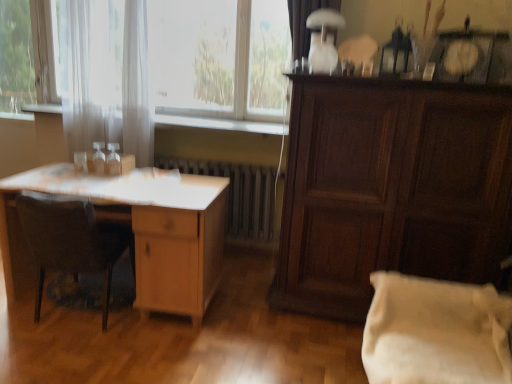
Question: Is white sheer curtain at left, which is the 1th curtain from back to front, wider than metallic silver radiator at center?

Choices:
 (A) yes
 (B) no

Answer: (A)

Question: From the image's perspective, is white sheer curtain at left, placed as the 1th curtain when sorted from left to right, on top of metallic silver radiator at center?

Choices:
 (A) yes
 (B) no

Answer: (A)

Question: Does white sheer curtain at left, placed as the 1th curtain when sorted from left to right, contain metallic silver radiator at center?

Choices:
 (A) no
 (B) yes

Answer: (A)

Question: Can you confirm if white sheer curtain at left, placed as the 1th curtain when sorted from left to right, is taller than metallic silver radiator at center?

Choices:
 (A) no
 (B) yes

Answer: (B)

Question: From the image's perspective, would you say white sheer curtain at left, placed as the 1th curtain when sorted from left to right, is shown under metallic silver radiator at center?

Choices:
 (A) yes
 (B) no

Answer: (B)

Question: Does point (437, 173) appear closer or farther from the camera than point (128, 243)?

Choices:
 (A) closer
 (B) farther

Answer: (A)

Question: From the image's perspective, is dark wood cabinet at right above or below wooden chair at left?

Choices:
 (A) below
 (B) above

Answer: (B)

Question: Is dark wood cabinet at right in front of or behind wooden chair at left in the image?

Choices:
 (A) front
 (B) behind

Answer: (A)

Question: In terms of size, does dark wood cabinet at right appear bigger or smaller than wooden chair at left?

Choices:
 (A) small
 (B) big

Answer: (B)

Question: From a real-world perspective, is dark wood cabinet at right positioned above or below light wood desk at left?

Choices:
 (A) below
 (B) above

Answer: (B)

Question: From the image's perspective, is dark wood cabinet at right above or below light wood desk at left?

Choices:
 (A) above
 (B) below

Answer: (A)

Question: Do you think dark wood cabinet at right is within light wood desk at left, or outside of it?

Choices:
 (A) outside
 (B) inside

Answer: (A)

Question: Is dark wood cabinet at right wider or thinner than light wood desk at left?

Choices:
 (A) wide
 (B) thin

Answer: (B)

Question: Would you say white sheer curtain at upper left is to the left or to the right of white cotton pillow at lower right in the picture?

Choices:
 (A) left
 (B) right

Answer: (A)

Question: Looking at the image, does white sheer curtain at upper left seem bigger or smaller compared to white cotton pillow at lower right?

Choices:
 (A) small
 (B) big

Answer: (B)